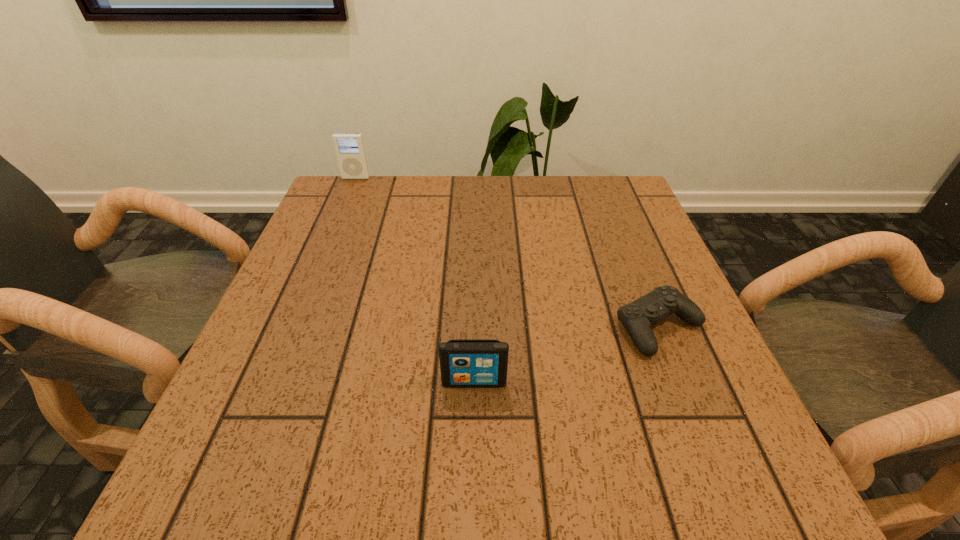
What are the coordinates of `unoccupied area between the shortest object and the left iPod` in the screenshot? It's located at (508, 253).

Select which object appears as the second closest to the left iPod. Please provide its 2D coordinates. Your answer should be formatted as a tuple, i.e. [(x, y)], where the tuple contains the x and y coordinates of a point satisfying the conditions above.

[(637, 317)]

Choose which object is the nearest neighbor to the shorter iPod. Please provide its 2D coordinates. Your answer should be formatted as a tuple, i.e. [(x, y)], where the tuple contains the x and y coordinates of a point satisfying the conditions above.

[(637, 317)]

I want to click on free spot that satisfies the following two spatial constraints: 1. on the front-facing side of the rightmost object; 2. on the right side of the farther iPod, so click(x=294, y=328).

What are the coordinates of `vacant region that satisfies the following two spatial constraints: 1. on the front-facing side of the farther iPod; 2. on the right side of the rightmost object` in the screenshot? It's located at (294, 328).

At what (x,y) coordinates should I click in order to perform the action: click on free space that satisfies the following two spatial constraints: 1. on the front-facing side of the rightmost object; 2. on the right side of the farthest object. Please return your answer as a coordinate pair (x, y). The height and width of the screenshot is (540, 960). Looking at the image, I should click on (294, 328).